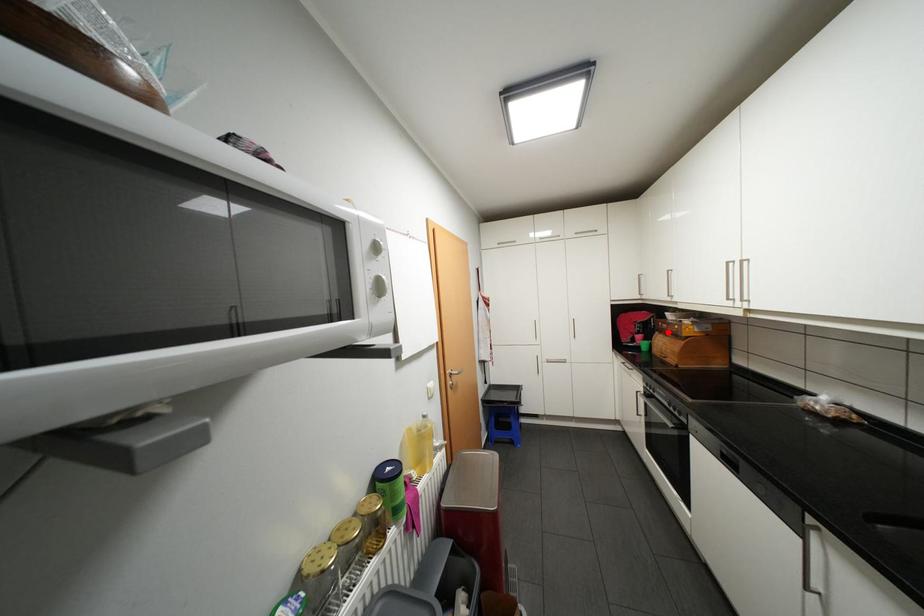
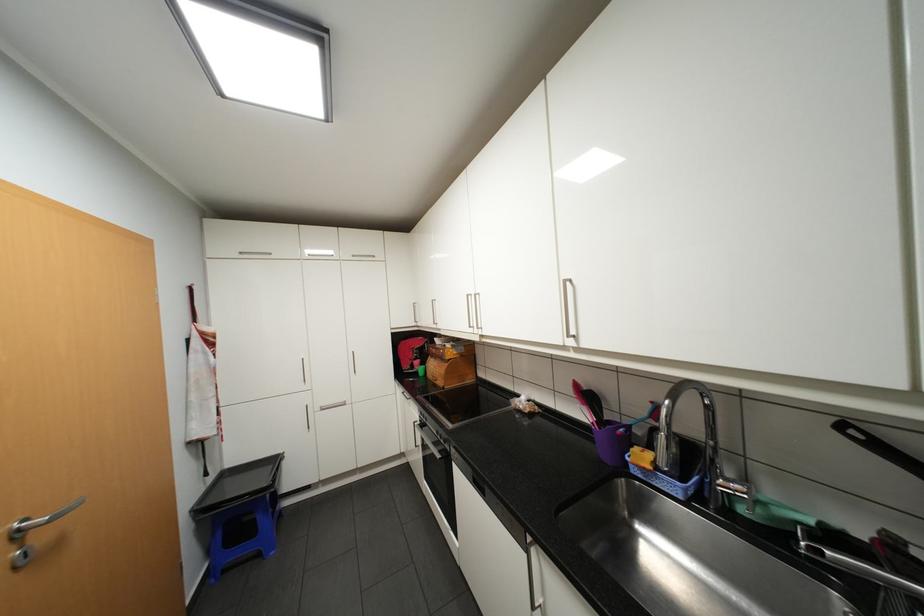
Find the pixel in the second image that matches the highlighted location in the first image.

(440, 355)